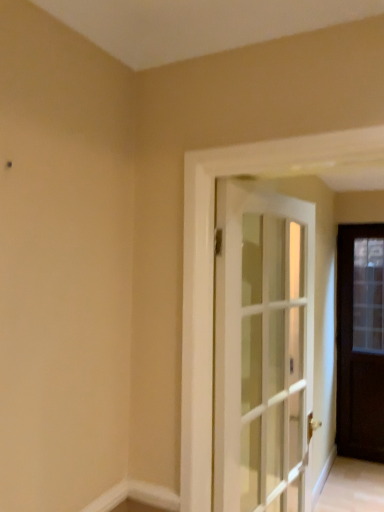
Identify the location of white glass door at center, the first door positioned from the left. The image size is (384, 512). (263, 350).

Is white glass door at center, which ranks as the first door in front-to-back order, oriented towards dark wood door at right, which is the second door in front-to-back order?

No, white glass door at center, which ranks as the first door in front-to-back order, is not aimed at dark wood door at right, which is the second door in front-to-back order.

Is white glass door at center, which ranks as the first door in front-to-back order, beside dark wood door at right, the 1th door positioned from the back?

white glass door at center, which ranks as the first door in front-to-back order, and dark wood door at right, the 1th door positioned from the back, are not in contact.

Between white glass door at center, marked as the 2th door in a back-to-front arrangement, and dark wood door at right, the 1th door positioned from the back, which one has more height?

dark wood door at right, the 1th door positioned from the back.

Is white glass door at center, which ranks as the first door in front-to-back order, not inside dark wood door at right, the 1th door positioned from the back?

Absolutely, white glass door at center, which ranks as the first door in front-to-back order, is external to dark wood door at right, the 1th door positioned from the back.

Is dark wood door at right, which is counted as the 2th door, starting from the left, looking in the opposite direction of white glass door at center, which ranks as the first door in front-to-back order?

No.

At what (x,y) coordinates should I click in order to perform the action: click on door located underneath the white glass door at center, which ranks as the first door in front-to-back order (from a real-world perspective). Please return your answer as a coordinate pair (x, y). This screenshot has width=384, height=512. Looking at the image, I should click on (360, 342).

Would you say dark wood door at right, the 1th door positioned from the back, is outside white glass door at center, which ranks as the first door in front-to-back order?

Yes, dark wood door at right, the 1th door positioned from the back, is located beyond the bounds of white glass door at center, which ranks as the first door in front-to-back order.

Which object is closer to the camera, white glass door at center, marked as the 2th door in a back-to-front arrangement, or white smooth baseboard at lower center?

white smooth baseboard at lower center is closer to the camera.

Between white glass door at center, which ranks as the first door in front-to-back order, and white smooth baseboard at lower center, which one appears on the right side from the viewer's perspective?

From the viewer's perspective, white glass door at center, which ranks as the first door in front-to-back order, appears more on the right side.

Looking at this image, how many degrees apart are the facing directions of white glass door at center, the first door positioned from the left, and white smooth baseboard at lower center?

There is a 83.8-degree angle between the facing directions of white glass door at center, the first door positioned from the left, and white smooth baseboard at lower center.

Based on the photo, from the image's perspective, is white glass door at center, acting as the second door starting from the right, under white smooth baseboard at lower center?

No, from the image's perspective, white glass door at center, acting as the second door starting from the right, is not beneath white smooth baseboard at lower center.

Looking at this image, from a real-world perspective, between white smooth baseboard at lower center and white glass door at center, the first door positioned from the left, who is vertically higher?

A: white glass door at center, the first door positioned from the left.

From the white smooth baseboard at lower center, count 1st doors backward and point to it. Please provide its 2D coordinates.

[(263, 350)]

Does white smooth baseboard at lower center have a smaller size compared to white glass door at center, marked as the 2th door in a back-to-front arrangement?

Correct, white smooth baseboard at lower center occupies less space than white glass door at center, marked as the 2th door in a back-to-front arrangement.

In the scene shown: Which of these two, white smooth baseboard at lower center or white glass door at center, which ranks as the first door in front-to-back order, is thinner?

white smooth baseboard at lower center.

From a real-world perspective, is white smooth baseboard at lower center physically located above or below dark wood door at right, the 1th door positioned from the back?

white smooth baseboard at lower center is situated lower than dark wood door at right, the 1th door positioned from the back, in the real world.

Does white smooth baseboard at lower center have a smaller size compared to dark wood door at right, arranged as the first door when viewed from the right?

Correct, white smooth baseboard at lower center occupies less space than dark wood door at right, arranged as the first door when viewed from the right.

Considering the points (96, 508) and (380, 444), which point is in front, point (96, 508) or point (380, 444)?

The point (96, 508) is in front.

How many degrees apart are the facing directions of dark wood door at right, the 1th door positioned from the back, and white smooth baseboard at lower center?

The angle between the facing direction of dark wood door at right, the 1th door positioned from the back, and the facing direction of white smooth baseboard at lower center is 0.132 degrees.

Does point (361, 408) appear closer or farther from the camera than point (148, 483)?

Clearly, point (361, 408) is more distant from the camera than point (148, 483).

Which object is further away from the camera, dark wood door at right, the 1th door positioned from the back, or white smooth baseboard at lower center?

dark wood door at right, the 1th door positioned from the back, is behind.

In terms of width, does dark wood door at right, the 1th door positioned from the back, look wider or thinner when compared to white smooth baseboard at lower center?

Considering their sizes, dark wood door at right, the 1th door positioned from the back, looks broader than white smooth baseboard at lower center.

At what (x,y) coordinates should I click in order to perform the action: click on door in front of the dark wood door at right, which is counted as the 2th door, starting from the left. Please return your answer as a coordinate pair (x, y). This screenshot has width=384, height=512. Looking at the image, I should click on (263, 350).

I want to click on door beneath the white glass door at center, the first door positioned from the left (from a real-world perspective), so click(x=360, y=342).

Estimate the real-world distances between objects in this image. Which object is closer to white smooth baseboard at lower center, dark wood door at right, arranged as the first door when viewed from the right, or white glass door at center, which ranks as the first door in front-to-back order?

The object closer to white smooth baseboard at lower center is white glass door at center, which ranks as the first door in front-to-back order.

When comparing their distances from dark wood door at right, arranged as the first door when viewed from the right, does white glass door at center, marked as the 2th door in a back-to-front arrangement, or white smooth baseboard at lower center seem closer?

white glass door at center, marked as the 2th door in a back-to-front arrangement, is closer to dark wood door at right, arranged as the first door when viewed from the right.

From the image, which object appears to be nearer to white glass door at center, which ranks as the first door in front-to-back order, dark wood door at right, the 1th door positioned from the back, or white smooth baseboard at lower center?

Based on the image, white smooth baseboard at lower center appears to be nearer to white glass door at center, which ranks as the first door in front-to-back order.

Considering their positions, is white glass door at center, which ranks as the first door in front-to-back order, positioned further to white smooth baseboard at lower center than dark wood door at right, the 1th door positioned from the back?

dark wood door at right, the 1th door positioned from the back.

Considering their positions, is white smooth baseboard at lower center positioned further to white glass door at center, marked as the 2th door in a back-to-front arrangement, than dark wood door at right, the 1th door positioned from the back?

dark wood door at right, the 1th door positioned from the back, lies further to white glass door at center, marked as the 2th door in a back-to-front arrangement, than the other object.

Estimate the real-world distances between objects in this image. Which object is closer to dark wood door at right, which is counted as the 2th door, starting from the left, white smooth baseboard at lower center or white glass door at center, marked as the 2th door in a back-to-front arrangement?

Based on the image, white glass door at center, marked as the 2th door in a back-to-front arrangement, appears to be nearer to dark wood door at right, which is counted as the 2th door, starting from the left.

What are the coordinates of `door located between white smooth baseboard at lower center and dark wood door at right, which is counted as the 2th door, starting from the left, in the depth direction` in the screenshot? It's located at (263, 350).